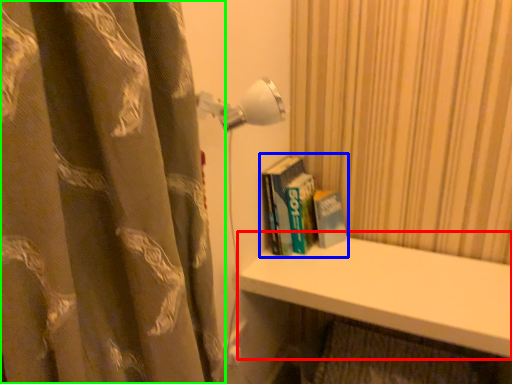
Question: Based on their relative distances, which object is nearer to window sill (highlighted by a red box)? Choose from book (highlighted by a blue box) and curtain (highlighted by a green box).

Choices:
 (A) book
 (B) curtain

Answer: (A)